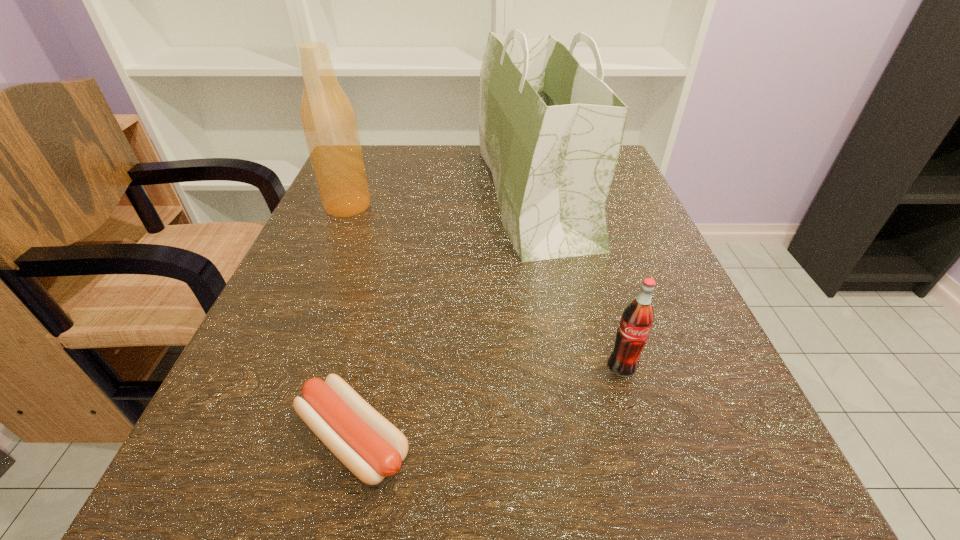
Identify the location of free space that is in between the soda bottle and the grocery bag. This screenshot has height=540, width=960. (578, 281).

You are a GUI agent. You are given a task and a screenshot of the screen. Output one action in this format:
    pyautogui.click(x=<x>, y=<y>)
    Task: Click on the free point between the beer bottle and the third object from right to left
    The height and width of the screenshot is (540, 960).
    Given the screenshot: What is the action you would take?
    pyautogui.click(x=350, y=322)

Identify the location of vacant area that lies between the beer bottle and the soda bottle. The image size is (960, 540). (485, 286).

Where is `empty space that is in between the soda bottle and the leftmost object`? The height and width of the screenshot is (540, 960). empty space that is in between the soda bottle and the leftmost object is located at coordinates (485, 286).

The width and height of the screenshot is (960, 540). What are the coordinates of `vacant space that is in between the beer bottle and the third farthest object` in the screenshot? It's located at (485, 286).

Identify which object is the second closest to the soda bottle. Please provide its 2D coordinates. Your answer should be formatted as a tuple, i.e. [(x, y)], where the tuple contains the x and y coordinates of a point satisfying the conditions above.

[(371, 447)]

Locate which object ranks second in proximity to the nearest object. Please provide its 2D coordinates. Your answer should be formatted as a tuple, i.e. [(x, y)], where the tuple contains the x and y coordinates of a point satisfying the conditions above.

[(550, 131)]

You are a GUI agent. You are given a task and a screenshot of the screen. Output one action in this format:
    pyautogui.click(x=<x>, y=<y>)
    Task: Click on the free space in the image that satisfies the following two spatial constraints: 1. on the back side of the grocery bag; 2. on the right side of the beer bottle
    The image size is (960, 540).
    Given the screenshot: What is the action you would take?
    pyautogui.click(x=352, y=194)

At what (x,y) coordinates should I click in order to perform the action: click on vacant position in the image that satisfies the following two spatial constraints: 1. on the front side of the shortest object; 2. on the left side of the leftmost object. Please return your answer as a coordinate pair (x, y). The height and width of the screenshot is (540, 960). Looking at the image, I should click on (249, 439).